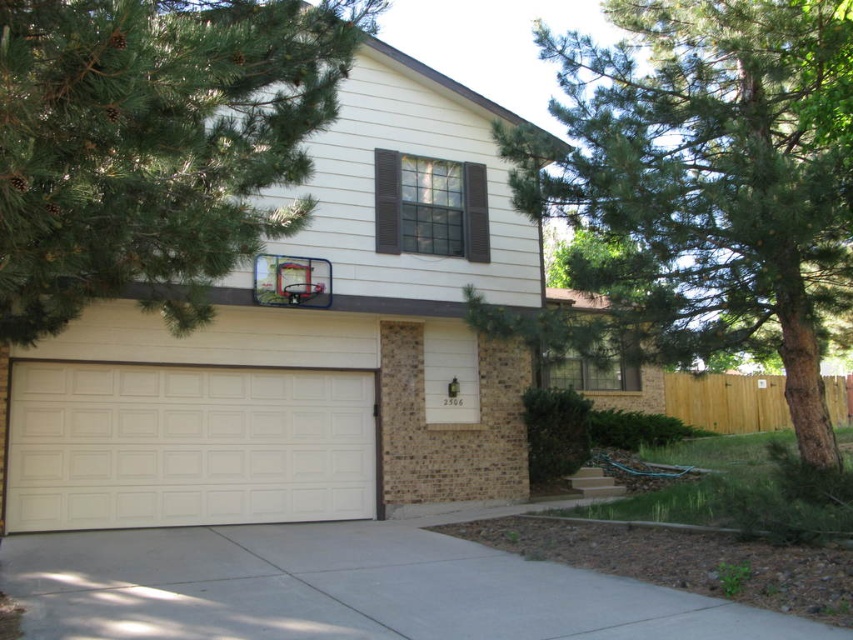
What do you see at coordinates (683, 561) in the screenshot? This screenshot has height=640, width=853. I see `gray concrete driveway at lower center` at bounding box center [683, 561].

Which of these two, gray concrete driveway at lower center or metallic silver basketball hoop at upper center, stands taller?

metallic silver basketball hoop at upper center is taller.

The image size is (853, 640). What do you see at coordinates (683, 561) in the screenshot?
I see `gray concrete driveway at lower center` at bounding box center [683, 561].

Identify the location of gray concrete driveway at lower center. The image size is (853, 640). (683, 561).

How far apart are green leafy tree at upper left and metallic silver basketball hoop at upper center?

They are 3.80 meters apart.

Between green leafy tree at upper left and metallic silver basketball hoop at upper center, which one appears on the right side from the viewer's perspective?

metallic silver basketball hoop at upper center is more to the right.

At what (x,y) coordinates should I click in order to perform the action: click on green leafy tree at upper left. Please return your answer as a coordinate pair (x, y). The image size is (853, 640). Looking at the image, I should click on (154, 145).

Does white painted wood garage door at center appear on the right side of concrete at center?

No, white painted wood garage door at center is not to the right of concrete at center.

Does white painted wood garage door at center appear over concrete at center?

Indeed, white painted wood garage door at center is positioned over concrete at center.

Find the location of a particular element. This screenshot has width=853, height=640. white painted wood garage door at center is located at coordinates (305, 348).